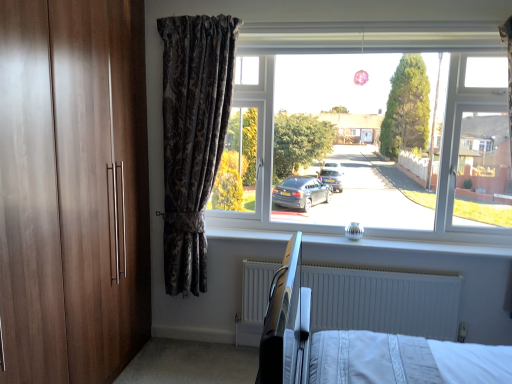
The height and width of the screenshot is (384, 512). I want to click on free space above white textured radiator at lower center (from a real-world perspective), so click(330, 269).